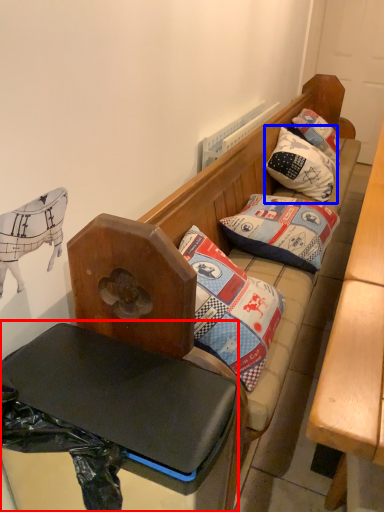
Question: Among these objects, which one is farthest to the camera, table (highlighted by a red box) or pillow (highlighted by a blue box)?

Choices:
 (A) table
 (B) pillow

Answer: (B)